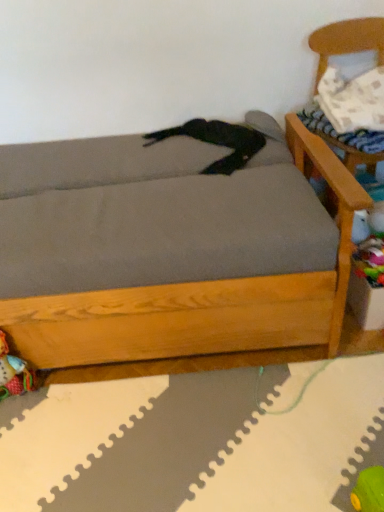
Question: Can you confirm if gray fabric studio couch at center is shorter than multicolored plastic toy at lower right, the 2th toy positioned from the bottom?

Choices:
 (A) no
 (B) yes

Answer: (A)

Question: Is gray fabric studio couch at center taller than multicolored plastic toy at lower right, which appears as the second toy when viewed from the left?

Choices:
 (A) yes
 (B) no

Answer: (A)

Question: Would you say gray fabric studio couch at center contains multicolored plastic toy at lower right, which is the 1th toy in right-to-left order?

Choices:
 (A) no
 (B) yes

Answer: (A)

Question: From the image's perspective, does gray fabric studio couch at center appear lower than multicolored plastic toy at lower right, which appears as the second toy when viewed from the left?

Choices:
 (A) yes
 (B) no

Answer: (B)

Question: Can you confirm if gray fabric studio couch at center is wider than multicolored plastic toy at lower right, the 2th toy positioned from the bottom?

Choices:
 (A) yes
 (B) no

Answer: (A)

Question: Is gray fabric studio couch at center further to camera compared to multicolored plastic toy at lower right, which is the 1th toy in right-to-left order?

Choices:
 (A) no
 (B) yes

Answer: (A)

Question: Does multicolored fabric toy at lower left, the 2th toy positioned from the right, appear on the right side of white textured pillow at upper right?

Choices:
 (A) no
 (B) yes

Answer: (A)

Question: Is multicolored fabric toy at lower left, the 1th toy in the bottom-to-top sequence, directly adjacent to white textured pillow at upper right?

Choices:
 (A) yes
 (B) no

Answer: (B)

Question: From a real-world perspective, is multicolored fabric toy at lower left, the 2th toy positioned from the right, on white textured pillow at upper right?

Choices:
 (A) no
 (B) yes

Answer: (A)

Question: Is multicolored fabric toy at lower left, the 1th toy positioned from the left, oriented away from white textured pillow at upper right?

Choices:
 (A) yes
 (B) no

Answer: (B)

Question: Does multicolored fabric toy at lower left, the 1th toy in the bottom-to-top sequence, turn towards white textured pillow at upper right?

Choices:
 (A) yes
 (B) no

Answer: (B)

Question: From a real-world perspective, is multicolored fabric toy at lower left, the 2th toy positioned from the right, physically below white textured pillow at upper right?

Choices:
 (A) no
 (B) yes

Answer: (B)

Question: Is wooden armchair at upper right next to white textured pillow at upper right and touching it?

Choices:
 (A) no
 (B) yes

Answer: (A)